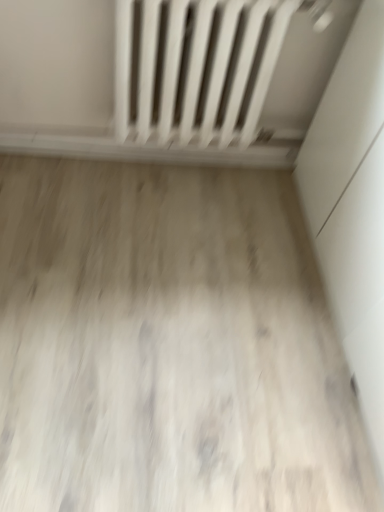
This screenshot has height=512, width=384. What do you see at coordinates (196, 67) in the screenshot?
I see `white matte radiator at upper center` at bounding box center [196, 67].

At what (x,y) coordinates should I click in order to perform the action: click on white matte radiator at upper center. Please return your answer as a coordinate pair (x, y). The height and width of the screenshot is (512, 384). Looking at the image, I should click on (196, 67).

What is the approximate width of wooden floor at center?

wooden floor at center is 1.31 meters in width.

At what (x,y) coordinates should I click in order to perform the action: click on wooden floor at center. Please return your answer as a coordinate pair (x, y). This screenshot has width=384, height=512. Looking at the image, I should click on (x=168, y=345).

The height and width of the screenshot is (512, 384). Describe the element at coordinates (168, 345) in the screenshot. I see `wooden floor at center` at that location.

The width and height of the screenshot is (384, 512). In order to click on white matte radiator at upper center in this screenshot , I will do `click(196, 67)`.

Which object is positioned more to the left, white matte radiator at upper center or wooden floor at center?

Positioned to the left is wooden floor at center.

Which is behind, white matte radiator at upper center or wooden floor at center?

Positioned behind is white matte radiator at upper center.

Which is nearer, (251,124) or (164,356)?

Point (251,124) appears to be farther away from the viewer than point (164,356).

From the image's perspective, relative to wooden floor at center, is white matte radiator at upper center above or below?

white matte radiator at upper center is above wooden floor at center.

From a real-world perspective, is white matte radiator at upper center below wooden floor at center?

No, from a real-world perspective, white matte radiator at upper center is not below wooden floor at center.

Considering the sizes of objects white matte radiator at upper center and wooden floor at center in the image provided, who is thinner, white matte radiator at upper center or wooden floor at center?

white matte radiator at upper center.

Which of these two, white matte radiator at upper center or wooden floor at center, stands taller?

white matte radiator at upper center is taller.

Based on their sizes in the image, would you say white matte radiator at upper center is bigger or smaller than wooden floor at center?

In the image, white matte radiator at upper center appears to be larger than wooden floor at center.

Is wooden floor at center a part of white matte radiator at upper center?

Actually, wooden floor at center is outside white matte radiator at upper center.

Is white matte radiator at upper center touching wooden floor at center?

They are not placed beside each other.

Is white matte radiator at upper center oriented away from wooden floor at center?

No, white matte radiator at upper center is not facing the opposite direction of wooden floor at center.

How distant is white matte radiator at upper center from wooden floor at center?

white matte radiator at upper center and wooden floor at center are 64.74 centimeters apart from each other.

Find the location of `plain beneath the white matte radiator at upper center (from a real-world perspective)`. plain beneath the white matte radiator at upper center (from a real-world perspective) is located at coordinates (168, 345).

From the picture: Which object is positioned more to the left, wooden floor at center or white matte radiator at upper center?

wooden floor at center is more to the left.

Does wooden floor at center lie in front of white matte radiator at upper center?

Yes, wooden floor at center is in front of white matte radiator at upper center.

Which is less distant, (306, 263) or (202, 44)?

Point (202, 44)

From the image's perspective, does wooden floor at center appear higher than white matte radiator at upper center?

Actually, wooden floor at center appears below white matte radiator at upper center in the image.

From the picture: From a real-world perspective, which object stands above the other?

white matte radiator at upper center.

Does wooden floor at center have a greater width compared to white matte radiator at upper center?

Correct, the width of wooden floor at center exceeds that of white matte radiator at upper center.

Does wooden floor at center have a lesser height compared to white matte radiator at upper center?

Indeed, wooden floor at center has a lesser height compared to white matte radiator at upper center.

Between wooden floor at center and white matte radiator at upper center, which one has larger size?

With larger size is white matte radiator at upper center.

Would you say wooden floor at center contains white matte radiator at upper center?

Actually, white matte radiator at upper center is outside wooden floor at center.

Is wooden floor at center beside white matte radiator at upper center?

They are not placed beside each other.

Based on the photo, is white matte radiator at upper center at the back of wooden floor at center?

No, wooden floor at center is not facing the opposite direction of white matte radiator at upper center.

What's the angular difference between wooden floor at center and white matte radiator at upper center's facing directions?

wooden floor at center and white matte radiator at upper center are facing 89.3 degrees away from each other.

How much distance is there between wooden floor at center and white matte radiator at upper center?

wooden floor at center is 25.49 inches away from white matte radiator at upper center.

You are a GUI agent. You are given a task and a screenshot of the screen. Output one action in this format:
    pyautogui.click(x=<x>, y=<y>)
    Task: Click on the plain that appears below the white matte radiator at upper center (from a real-world perspective)
    
    Given the screenshot: What is the action you would take?
    pyautogui.click(x=168, y=345)

I want to click on radiator that is above the wooden floor at center (from a real-world perspective), so click(x=196, y=67).

Locate an element on the screen. The height and width of the screenshot is (512, 384). radiator on the right side of wooden floor at center is located at coordinates (196, 67).